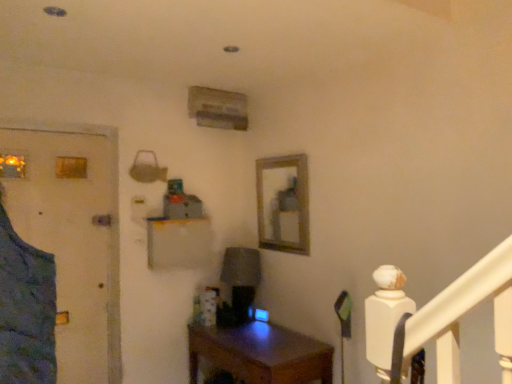
Question: Should I look upward or downward to see wooden frame at center?

Choices:
 (A) up
 (B) down

Answer: (B)

Question: Is blue fabric door at left smaller than wooden frame at center?

Choices:
 (A) yes
 (B) no

Answer: (B)

Question: Considering the relative sizes of blue fabric door at left and wooden frame at center in the image provided, is blue fabric door at left shorter than wooden frame at center?

Choices:
 (A) yes
 (B) no

Answer: (B)

Question: Is blue fabric door at left positioned with its back to wooden frame at center?

Choices:
 (A) no
 (B) yes

Answer: (A)

Question: Considering the relative sizes of blue fabric door at left and wooden frame at center in the image provided, is blue fabric door at left taller than wooden frame at center?

Choices:
 (A) no
 (B) yes

Answer: (B)

Question: Could wooden frame at center be considered to be inside blue fabric door at left?

Choices:
 (A) no
 (B) yes

Answer: (A)

Question: Is there a large distance between blue fabric door at left and wooden frame at center?

Choices:
 (A) no
 (B) yes

Answer: (B)

Question: Can you confirm if wooden desk at center is thinner than wooden frame at center?

Choices:
 (A) yes
 (B) no

Answer: (B)

Question: Is wooden desk at center far away from wooden frame at center?

Choices:
 (A) yes
 (B) no

Answer: (B)

Question: Is wooden frame at center at the back of wooden desk at center?

Choices:
 (A) no
 (B) yes

Answer: (A)

Question: Is the depth of wooden desk at center greater than that of wooden frame at center?

Choices:
 (A) no
 (B) yes

Answer: (A)

Question: Is wooden desk at center outside wooden frame at center?

Choices:
 (A) no
 (B) yes

Answer: (B)

Question: Is wooden desk at center taller than wooden frame at center?

Choices:
 (A) no
 (B) yes

Answer: (A)

Question: Is blue fabric door at left not inside wooden desk at center?

Choices:
 (A) no
 (B) yes

Answer: (B)